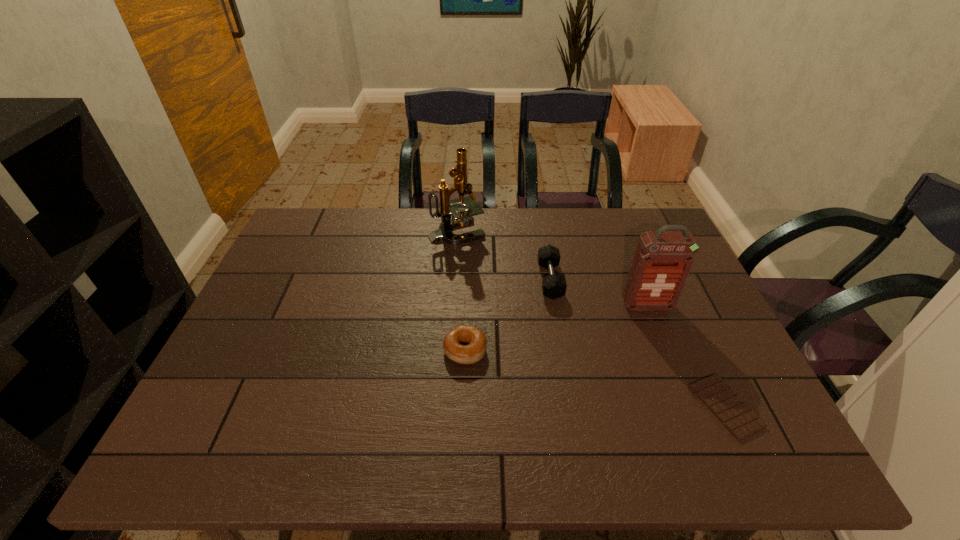
Find the location of a particular element. free spot that satisfies the following two spatial constraints: 1. at the eyepiece of the farthest object; 2. on the back side of the bagel is located at coordinates (449, 350).

I want to click on vacant space that satisfies the following two spatial constraints: 1. at the eyepiece of the nearest object; 2. on the right side of the farthest object, so pyautogui.click(x=445, y=406).